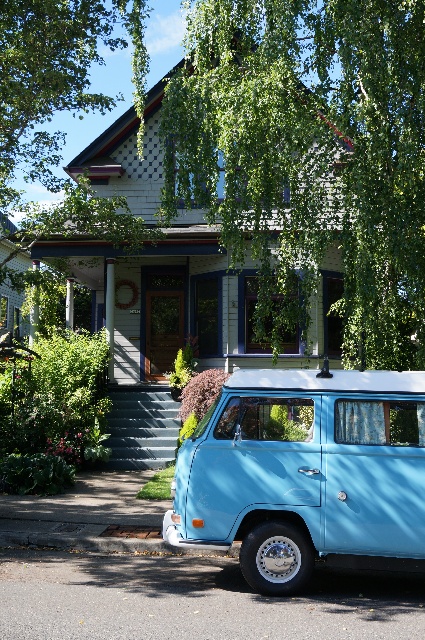
Who is more forward, (379, 106) or (323, 428)?

Positioned in front is point (323, 428).

Does point (249, 104) lie in front of point (377, 445)?

That is False.

Find the location of a particular element. The height and width of the screenshot is (640, 425). green leafy tree at upper center is located at coordinates (311, 150).

You are a GUI agent. You are given a task and a screenshot of the screen. Output one action in this format:
    pyautogui.click(x=<x>, y=<y>)
    Task: Click on the green leafy tree at upper center
    This screenshot has height=640, width=425.
    Given the screenshot: What is the action you would take?
    pyautogui.click(x=311, y=150)

Is light blue matte van at lower center closer to the viewer compared to smooth concrete steps at center?

Yes, it is.

Does point (399, 472) lie behind point (135, 401)?

No.

This screenshot has height=640, width=425. What are the coordinates of `light blue matte van at lower center` in the screenshot? It's located at (303, 472).

Does green leafy tree at upper center lie behind smooth concrete steps at center?

No, green leafy tree at upper center is in front of smooth concrete steps at center.

Based on the photo, who is more forward, (340, 76) or (147, 448)?

Point (340, 76)

Where is `green leafy tree at upper center`? This screenshot has height=640, width=425. green leafy tree at upper center is located at coordinates (311, 150).